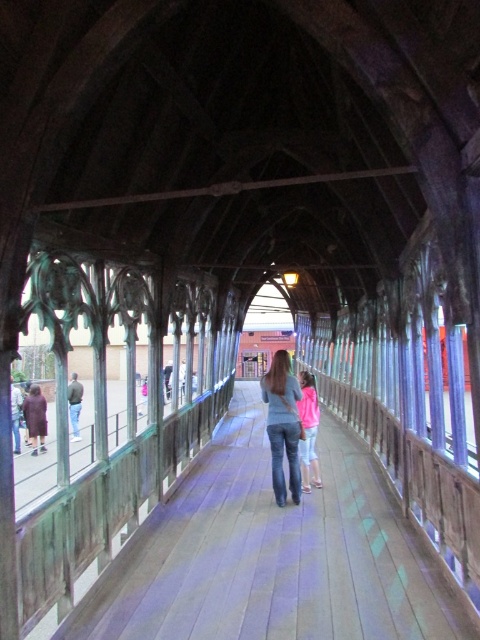
Which is more to the right, wooden walkway at center or denim jeans at center?

From the viewer's perspective, denim jeans at center appears more on the right side.

Between wooden walkway at center and denim jeans at center, which one appears on the left side from the viewer's perspective?

wooden walkway at center is more to the left.

Is point (373, 602) positioned behind point (264, 388)?

No, it is in front of (264, 388).

The height and width of the screenshot is (640, 480). What are the coordinates of `wooden walkway at center` in the screenshot? It's located at (271, 554).

Is wooden walkway at center wider than pink fleece jacket at center?

Incorrect, wooden walkway at center's width does not surpass pink fleece jacket at center's.

Can you confirm if wooden walkway at center is smaller than pink fleece jacket at center?

Correct, wooden walkway at center occupies less space than pink fleece jacket at center.

In order to click on wooden walkway at center in this screenshot , I will do `click(271, 554)`.

Where is `wooden walkway at center`? The image size is (480, 640). wooden walkway at center is located at coordinates (271, 554).

Identify the location of denim jeans at center. This screenshot has width=480, height=640. (283, 424).

Who is taller, denim jeans at center or pink fleece jacket at center?

pink fleece jacket at center is taller.

What are the coordinates of `denim jeans at center` in the screenshot? It's located at (283, 424).

You are a GUI agent. You are given a task and a screenshot of the screen. Output one action in this format:
    pyautogui.click(x=<x>, y=<y>)
    Task: Click on the denim jeans at center
    The height and width of the screenshot is (640, 480).
    Given the screenshot: What is the action you would take?
    pyautogui.click(x=283, y=424)